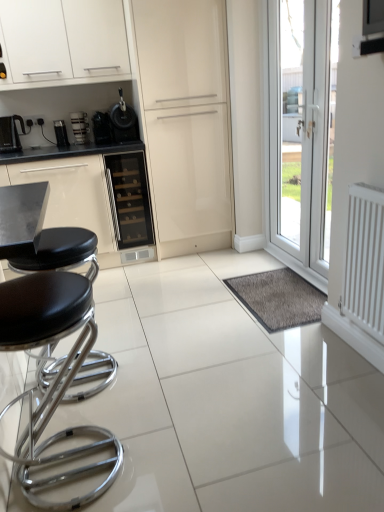
Question: Is white glossy cabinet at upper left completely or partially outside of black glass wine cooler at center?

Choices:
 (A) yes
 (B) no

Answer: (A)

Question: Considering the relative sizes of white glossy cabinet at upper left and black glass wine cooler at center in the image provided, is white glossy cabinet at upper left smaller than black glass wine cooler at center?

Choices:
 (A) no
 (B) yes

Answer: (A)

Question: Does white glossy cabinet at upper left lie behind black glass wine cooler at center?

Choices:
 (A) no
 (B) yes

Answer: (A)

Question: Is white glossy cabinet at upper left to the right of black glass wine cooler at center from the viewer's perspective?

Choices:
 (A) no
 (B) yes

Answer: (A)

Question: Are white glossy cabinet at upper left and black glass wine cooler at center located far from each other?

Choices:
 (A) no
 (B) yes

Answer: (A)

Question: From a real-world perspective, is white glossy cabinet at upper left positioned under black glass wine cooler at center based on gravity?

Choices:
 (A) yes
 (B) no

Answer: (B)

Question: Is glossy cream cabinet at center positioned with its back to black leather stool at left, which is the 2th stool in front-to-back order?

Choices:
 (A) yes
 (B) no

Answer: (B)

Question: Is glossy cream cabinet at center bigger than black leather stool at left, the first stool in the back-to-front sequence?

Choices:
 (A) no
 (B) yes

Answer: (B)

Question: Does glossy cream cabinet at center appear on the right side of black leather stool at left, which is the 2th stool in front-to-back order?

Choices:
 (A) yes
 (B) no

Answer: (A)

Question: Is the position of glossy cream cabinet at center more distant than that of black leather stool at left, the first stool in the back-to-front sequence?

Choices:
 (A) yes
 (B) no

Answer: (A)

Question: Is glossy cream cabinet at center smaller than black leather stool at left, the first stool in the back-to-front sequence?

Choices:
 (A) yes
 (B) no

Answer: (B)

Question: From the image's perspective, does glossy cream cabinet at center appear lower than black leather stool at left, which is the 2th stool in front-to-back order?

Choices:
 (A) yes
 (B) no

Answer: (B)

Question: Is the depth of white glossy cabinet at upper left greater than that of matte black coffee machine at left, the second coffee machine from the right?

Choices:
 (A) no
 (B) yes

Answer: (A)